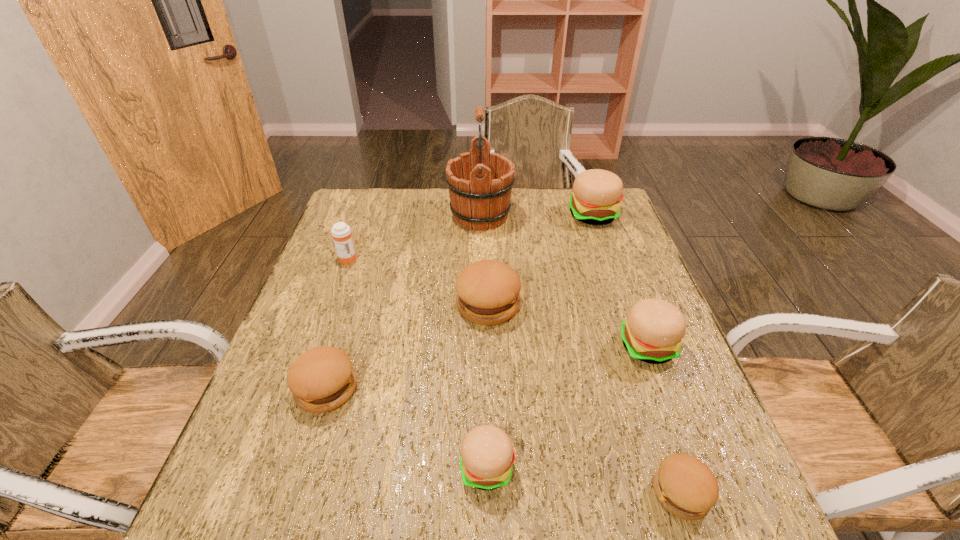
This screenshot has height=540, width=960. In order to click on the second biggest brown hamburger in this screenshot , I will do `click(321, 379)`.

The height and width of the screenshot is (540, 960). In order to click on the nearest beige hamburger in this screenshot , I will do `click(487, 455)`.

Locate an element on the screen. the leftmost beige hamburger is located at coordinates (487, 455).

Find the location of a particular element. The width and height of the screenshot is (960, 540). the rightmost brown hamburger is located at coordinates (686, 487).

What are the coordinates of `the shortest hamburger` in the screenshot? It's located at (686, 487).

Find the location of `free space located 0.120m on the right of the wine bucket`. free space located 0.120m on the right of the wine bucket is located at coordinates pos(549,215).

Identify the location of vacant area situated on the left of the farthest hamburger. The height and width of the screenshot is (540, 960). (457, 215).

Where is `blank space located on the front of the medicine`? blank space located on the front of the medicine is located at coordinates (337, 286).

Identify the location of free space located 0.380m on the back of the second biggest beige hamburger. (607, 234).

Where is `vacant space located on the front of the farthest brown hamburger`? Image resolution: width=960 pixels, height=540 pixels. vacant space located on the front of the farthest brown hamburger is located at coordinates (490, 380).